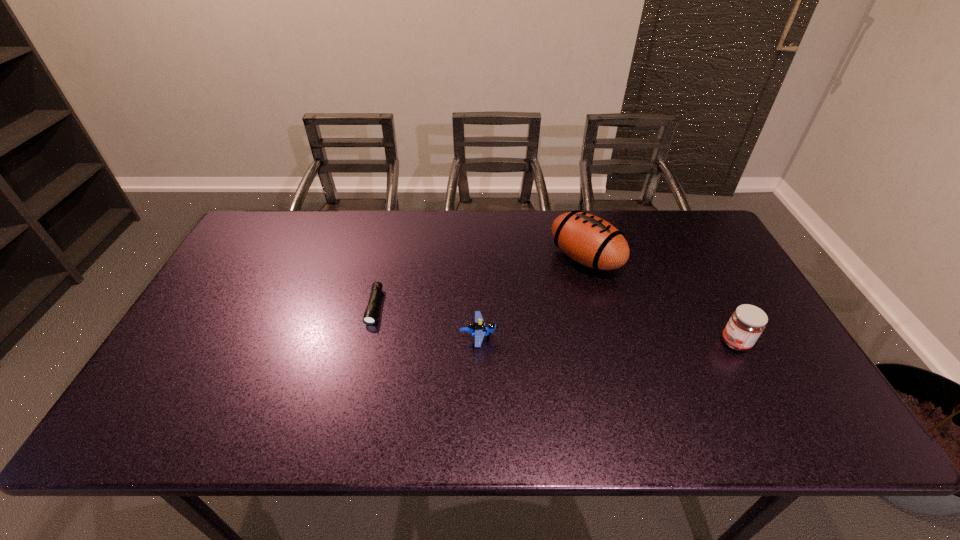
At what (x,y) coordinates should I click in order to perform the action: click on vacant area that lies between the third object from right to left and the third shortest object. Please return your answer as a coordinate pair (x, y). The width and height of the screenshot is (960, 540). Looking at the image, I should click on (607, 340).

Identify which object is located as the second nearest to the leftmost object. Please provide its 2D coordinates. Your answer should be formatted as a tuple, i.e. [(x, y)], where the tuple contains the x and y coordinates of a point satisfying the conditions above.

[(589, 240)]

Select which object is the third closest to the second object from right to left. Please provide its 2D coordinates. Your answer should be formatted as a tuple, i.e. [(x, y)], where the tuple contains the x and y coordinates of a point satisfying the conditions above.

[(370, 314)]

This screenshot has width=960, height=540. Identify the location of vacant space that satisfies the following two spatial constraints: 1. on the front side of the football (American); 2. on the front-facing side of the second shortest object. (607, 337).

Where is `vacant space that satisfies the following two spatial constraints: 1. at the lens end of the rightmost object; 2. on the left side of the shortest object`? This screenshot has width=960, height=540. vacant space that satisfies the following two spatial constraints: 1. at the lens end of the rightmost object; 2. on the left side of the shortest object is located at coordinates (366, 342).

Where is `free space that satisfies the following two spatial constraints: 1. on the front-facing side of the second shortest object; 2. on the left side of the rightmost object`? This screenshot has height=540, width=960. free space that satisfies the following two spatial constraints: 1. on the front-facing side of the second shortest object; 2. on the left side of the rightmost object is located at coordinates click(x=479, y=342).

This screenshot has height=540, width=960. In order to click on free point that satisfies the following two spatial constraints: 1. at the lens end of the third shortest object; 2. on the right side of the flashlight in this screenshot , I will do tap(366, 342).

At what (x,y) coordinates should I click in order to perform the action: click on vacant point that satisfies the following two spatial constraints: 1. on the front-facing side of the second shortest object; 2. on the back side of the jam. Please return your answer as a coordinate pair (x, y). Looking at the image, I should click on coord(479,342).

In order to click on free location that satisfies the following two spatial constraints: 1. on the front side of the rightmost object; 2. on the right side of the football (American) in this screenshot , I will do `click(608, 342)`.

Where is `free space in the image that satisfies the following two spatial constraints: 1. on the front side of the farthest object; 2. on the right side of the jam`? The image size is (960, 540). free space in the image that satisfies the following two spatial constraints: 1. on the front side of the farthest object; 2. on the right side of the jam is located at coordinates (608, 342).